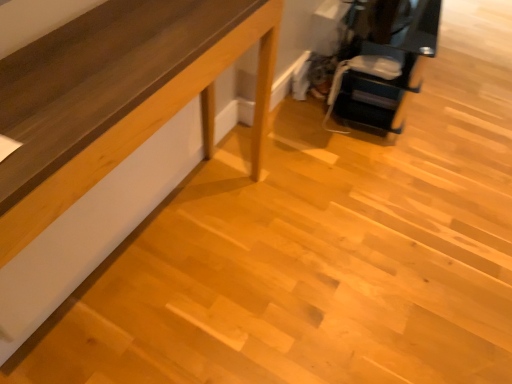
Question: Considering the relative positions of matte black printer at upper right, placed as the 1th furniture when sorted from right to left, and light brown wood table at lower left, acting as the 1th furniture starting from the bottom, in the image provided, is matte black printer at upper right, placed as the 1th furniture when sorted from right to left, behind light brown wood table at lower left, acting as the 1th furniture starting from the bottom,?

Choices:
 (A) yes
 (B) no

Answer: (A)

Question: Would you say matte black printer at upper right, placed as the 1th furniture when sorted from right to left, contains light brown wood table at lower left, the first furniture when ordered from left to right?

Choices:
 (A) no
 (B) yes

Answer: (A)

Question: Does matte black printer at upper right, marked as the 2th furniture in a bottom-to-top arrangement, have a larger size compared to light brown wood table at lower left, acting as the 1th furniture starting from the bottom?

Choices:
 (A) no
 (B) yes

Answer: (B)

Question: Is matte black printer at upper right, the 2th furniture from the left, to the right of light brown wood table at lower left, marked as the 2th furniture in a right-to-left arrangement, from the viewer's perspective?

Choices:
 (A) no
 (B) yes

Answer: (B)

Question: Is matte black printer at upper right, marked as the 2th furniture in a bottom-to-top arrangement, directly adjacent to light brown wood table at lower left, the first furniture when ordered from left to right?

Choices:
 (A) no
 (B) yes

Answer: (A)

Question: Is matte black printer at upper right, positioned as the first furniture in top-to-bottom order, oriented towards light brown wood table at lower left, which is the second furniture in top-to-bottom order?

Choices:
 (A) yes
 (B) no

Answer: (B)

Question: From a real-world perspective, is light brown wood table at lower left, the first furniture when ordered from left to right, located beneath matte black printer at upper right, the 2th furniture from the left?

Choices:
 (A) yes
 (B) no

Answer: (A)

Question: Considering the relative positions of light brown wood table at lower left, the first furniture when ordered from left to right, and matte black printer at upper right, placed as the 1th furniture when sorted from right to left, in the image provided, is light brown wood table at lower left, the first furniture when ordered from left to right, to the right of matte black printer at upper right, placed as the 1th furniture when sorted from right to left, from the viewer's perspective?

Choices:
 (A) no
 (B) yes

Answer: (A)

Question: From a real-world perspective, is light brown wood table at lower left, the first furniture when ordered from left to right, physically above matte black printer at upper right, marked as the 2th furniture in a bottom-to-top arrangement?

Choices:
 (A) yes
 (B) no

Answer: (B)

Question: Can you confirm if light brown wood table at lower left, the first furniture when ordered from left to right, is thinner than matte black printer at upper right, marked as the 2th furniture in a bottom-to-top arrangement?

Choices:
 (A) no
 (B) yes

Answer: (B)

Question: From the image's perspective, is light brown wood table at lower left, acting as the 1th furniture starting from the bottom, located above matte black printer at upper right, the 2th furniture from the left?

Choices:
 (A) no
 (B) yes

Answer: (A)

Question: Would you say light brown wood table at lower left, the first furniture when ordered from left to right, is a long distance from matte black printer at upper right, positioned as the first furniture in top-to-bottom order?

Choices:
 (A) yes
 (B) no

Answer: (A)

Question: From a real-world perspective, is light brown wood table at lower left, which is the second furniture in top-to-bottom order, above or below matte black printer at upper right, the 2th furniture from the left?

Choices:
 (A) above
 (B) below

Answer: (B)